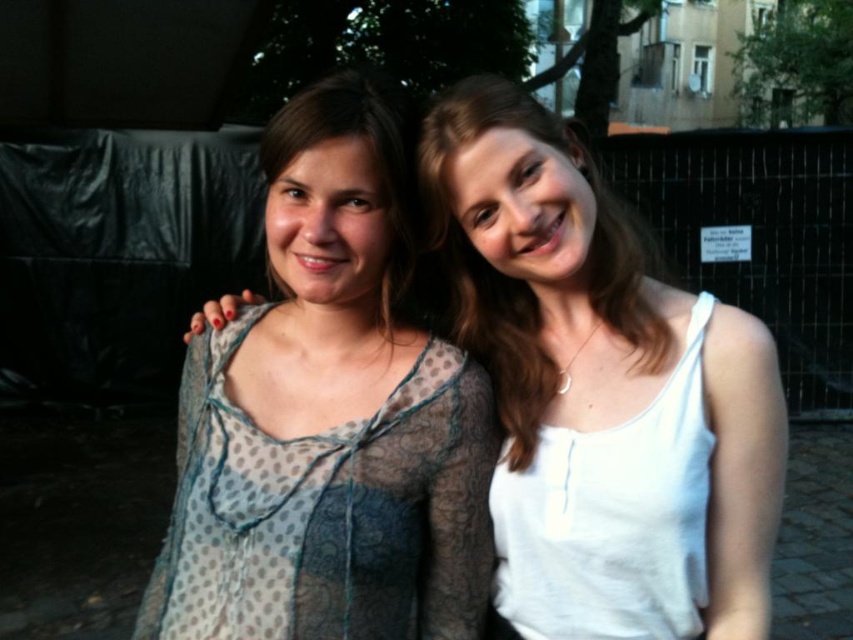
Question: Which point is farther to the camera?

Choices:
 (A) (637, 253)
 (B) (461, 308)
 (C) (546, 468)

Answer: (B)

Question: Which point is closer to the camera?

Choices:
 (A) polka dot sheer blouse at center
 (B) white cotton tank top at right
 (C) white matte tank top at center
 (D) translucent polka dot dress at center

Answer: (B)

Question: Does polka dot sheer blouse at center appear on the left side of white cotton tank top at right?

Choices:
 (A) yes
 (B) no

Answer: (A)

Question: Can you confirm if polka dot sheer blouse at center is positioned to the right of translucent polka dot dress at center?

Choices:
 (A) no
 (B) yes

Answer: (B)

Question: Can you confirm if polka dot sheer blouse at center is positioned above white matte tank top at center?

Choices:
 (A) no
 (B) yes

Answer: (A)

Question: Which of these objects is positioned farthest from the white cotton tank top at right?

Choices:
 (A) translucent polka dot dress at center
 (B) polka dot sheer blouse at center

Answer: (A)